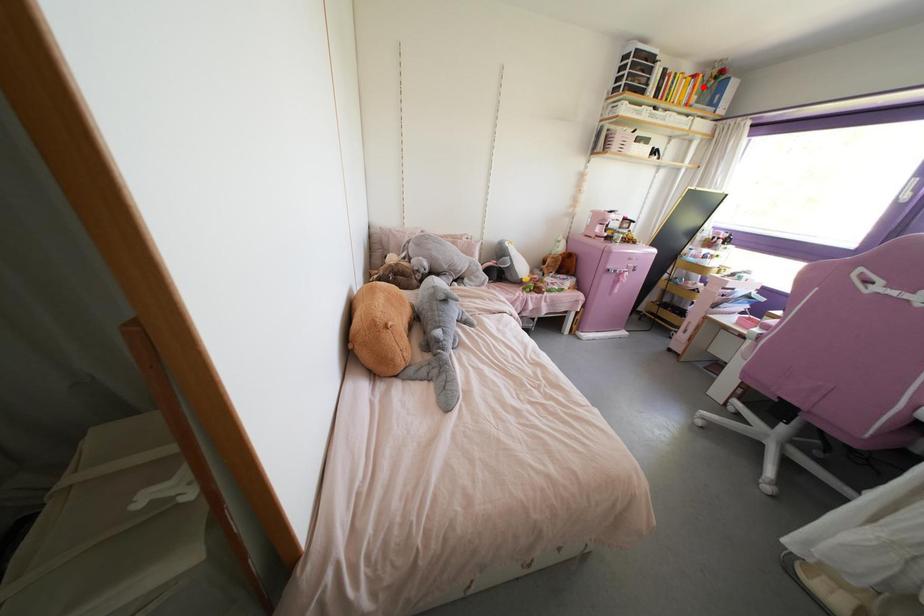
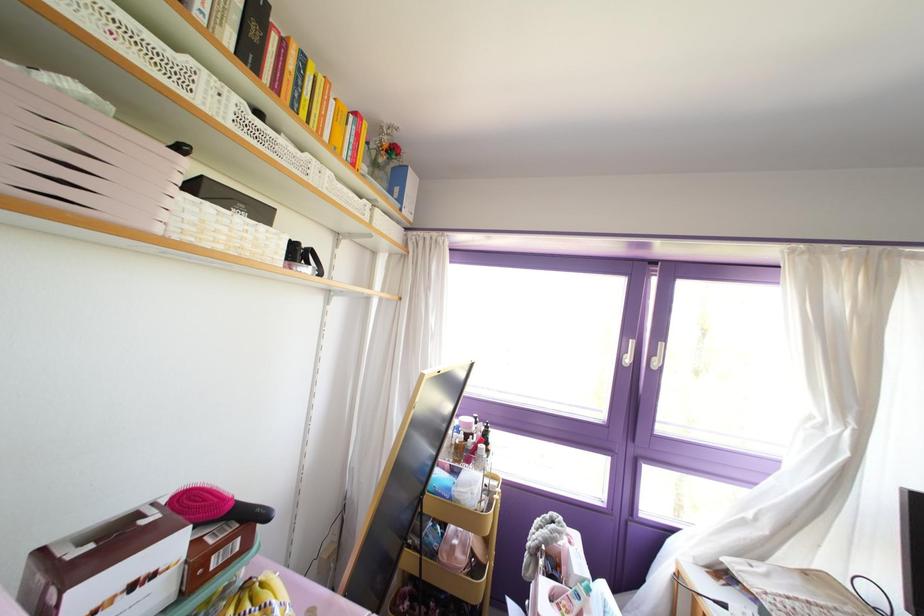
Where in the second image is the point corresponding to the highlighted location from the first image?

(372, 163)